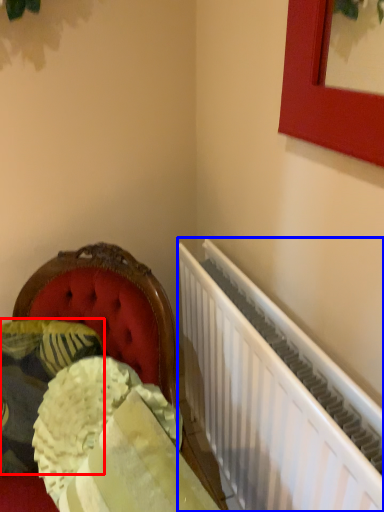
Question: Which object is further to the camera taking this photo, pillow (highlighted by a red box) or radiator (highlighted by a blue box)?

Choices:
 (A) pillow
 (B) radiator

Answer: (A)